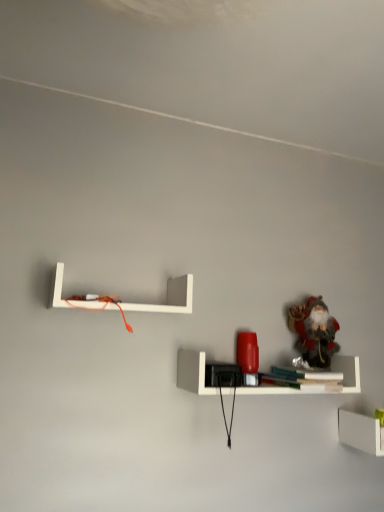
Question: Can you see white matte shelf at lower right, which appears as the 1th shelf when viewed from the right, touching frosted glass santa at upper right?

Choices:
 (A) no
 (B) yes

Answer: (A)

Question: From the image's perspective, is white matte shelf at lower right, which appears as the 1th shelf when viewed from the right, located above frosted glass santa at upper right?

Choices:
 (A) no
 (B) yes

Answer: (A)

Question: Is white matte shelf at lower right, the 3th shelf from the left, not inside frosted glass santa at upper right?

Choices:
 (A) no
 (B) yes

Answer: (B)

Question: Is white matte shelf at lower right, the 3th shelf from the left, looking in the opposite direction of frosted glass santa at upper right?

Choices:
 (A) yes
 (B) no

Answer: (B)

Question: Can you confirm if white matte shelf at lower right, which appears as the 1th shelf when viewed from the right, is positioned to the left of frosted glass santa at upper right?

Choices:
 (A) yes
 (B) no

Answer: (B)

Question: From the image's perspective, is white matte shelf at upper left, marked as the first shelf in a left-to-right arrangement, above or below matte red lamp at center, acting as the 2th shelf starting from the top?

Choices:
 (A) above
 (B) below

Answer: (A)

Question: Visually, is white matte shelf at upper left, which appears as the first shelf when viewed from the top, positioned to the left or to the right of matte red lamp at center, acting as the 2th shelf starting from the top?

Choices:
 (A) right
 (B) left

Answer: (B)

Question: In terms of width, does white matte shelf at upper left, which appears as the first shelf when viewed from the top, look wider or thinner when compared to matte red lamp at center, the 2th shelf when ordered from left to right?

Choices:
 (A) wide
 (B) thin

Answer: (B)

Question: Considering the positions of point (170, 282) and point (345, 364), is point (170, 282) closer or farther from the camera than point (345, 364)?

Choices:
 (A) closer
 (B) farther

Answer: (A)

Question: Do you think white matte line at upper center is within white matte shelf at lower right, the 3th shelf from the left, or outside of it?

Choices:
 (A) outside
 (B) inside

Answer: (A)

Question: In terms of height, does white matte line at upper center look taller or shorter compared to white matte shelf at lower right, which is the third shelf from top to bottom?

Choices:
 (A) short
 (B) tall

Answer: (A)

Question: From the image's perspective, is white matte line at upper center above or below white matte shelf at lower right, which appears as the 1th shelf when viewed from the right?

Choices:
 (A) below
 (B) above

Answer: (B)

Question: From a real-world perspective, relative to white matte shelf at lower right, which is the third shelf from top to bottom, is white matte line at upper center vertically above or below?

Choices:
 (A) below
 (B) above

Answer: (B)

Question: From the image's perspective, relative to white matte shelf at lower right, which is the third shelf from top to bottom, is frosted glass santa at upper right above or below?

Choices:
 (A) below
 (B) above

Answer: (B)

Question: Considering their positions, is frosted glass santa at upper right located in front of or behind white matte shelf at lower right, marked as the first shelf in a bottom-to-top arrangement?

Choices:
 (A) front
 (B) behind

Answer: (B)